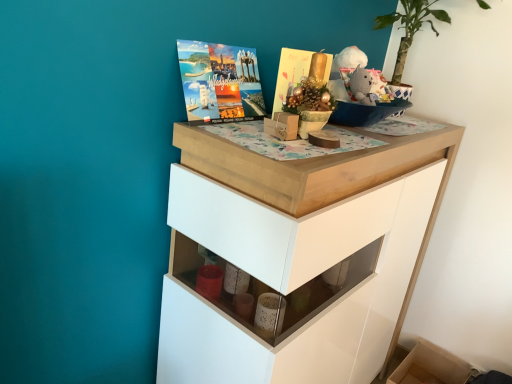
What do you see at coordinates (282, 126) in the screenshot? The image size is (512, 384). I see `matte brown box at center` at bounding box center [282, 126].

The image size is (512, 384). Identify the location of white glossy chest of drawers at upper center. (294, 257).

At what (x,y) coordinates should I click in order to perform the action: click on bare wood drawer at lower right. Please return your answer as a coordinate pair (x, y). The width and height of the screenshot is (512, 384). Looking at the image, I should click on (429, 367).

Image resolution: width=512 pixels, height=384 pixels. Find the location of `knitted gray bear at upper right`. knitted gray bear at upper right is located at coordinates (367, 86).

The height and width of the screenshot is (384, 512). I want to click on matte brown box at center, so click(282, 126).

Is matte brown box at center beside knitted gray bear at upper right?

They are not placed beside each other.

What's the angular difference between matte brown box at center and knitted gray bear at upper right's facing directions?

The facing directions of matte brown box at center and knitted gray bear at upper right are 11.1 degrees apart.

Can you confirm if matte brown box at center is bigger than knitted gray bear at upper right?

No, matte brown box at center is not bigger than knitted gray bear at upper right.

From a real-world perspective, is matte brown box at center above or below knitted gray bear at upper right?

From a real-world perspective, matte brown box at center is physically below knitted gray bear at upper right.

Is matte gold magazine at upper center beside white glossy chest of drawers at upper center?

There is a gap between matte gold magazine at upper center and white glossy chest of drawers at upper center.

Where is `magazine that is behind the white glossy chest of drawers at upper center`? magazine that is behind the white glossy chest of drawers at upper center is located at coordinates (290, 73).

Which object is positioned more to the left, matte gold magazine at upper center or white glossy chest of drawers at upper center?

From the viewer's perspective, matte gold magazine at upper center appears more on the left side.

Which is more distant, (290, 71) or (227, 162)?

The point (290, 71) is more distant.

Relative to matte gold magazine at upper center, is knitted gray bear at upper right in front or behind?

Clearly, knitted gray bear at upper right is behind matte gold magazine at upper center.

Is knitted gray bear at upper right spatially inside matte gold magazine at upper center, or outside of it?

knitted gray bear at upper right cannot be found inside matte gold magazine at upper center.

How much distance is there between knitted gray bear at upper right and matte gold magazine at upper center?

knitted gray bear at upper right is 10.01 inches away from matte gold magazine at upper center.

Does knitted gray bear at upper right have a greater width compared to matte gold magazine at upper center?

In fact, knitted gray bear at upper right might be narrower than matte gold magazine at upper center.

From a real-world perspective, who is located lower, bare wood drawer at lower right or matte brown box at center?

bare wood drawer at lower right, from a real-world perspective.

Is bare wood drawer at lower right with matte brown box at center?

bare wood drawer at lower right is not next to matte brown box at center, and they're not touching.

Measure the distance from bare wood drawer at lower right to matte brown box at center.

bare wood drawer at lower right and matte brown box at center are 4.93 feet apart from each other.

Is the depth of bare wood drawer at lower right less than that of knitted gray bear at upper right?

No, the depth of bare wood drawer at lower right is greater than that of knitted gray bear at upper right.

Which of these two, bare wood drawer at lower right or knitted gray bear at upper right, is smaller?

With smaller size is knitted gray bear at upper right.

From a real-world perspective, which is physically below, bare wood drawer at lower right or knitted gray bear at upper right?

bare wood drawer at lower right is physically lower.

Is bare wood drawer at lower right positioned with its back to matte gold magazine at upper center?

No, bare wood drawer at lower right is not facing away from matte gold magazine at upper center.

Considering the sizes of objects bare wood drawer at lower right and matte gold magazine at upper center in the image provided, who is smaller, bare wood drawer at lower right or matte gold magazine at upper center?

matte gold magazine at upper center is smaller.

Based on the photo, considering the sizes of objects bare wood drawer at lower right and matte gold magazine at upper center in the image provided, who is shorter, bare wood drawer at lower right or matte gold magazine at upper center?

Standing shorter between the two is matte gold magazine at upper center.

Is matte brown box at center to the left of bare wood drawer at lower right from the viewer's perspective?

Indeed, matte brown box at center is positioned on the left side of bare wood drawer at lower right.

Is matte brown box at center oriented away from bare wood drawer at lower right?

No, matte brown box at center is not facing the opposite direction of bare wood drawer at lower right.

How far apart are matte brown box at center and bare wood drawer at lower right?

matte brown box at center is 1.50 meters away from bare wood drawer at lower right.

Find the location of a particular element. box lying above the bare wood drawer at lower right (from the image's perspective) is located at coordinates (282, 126).

This screenshot has width=512, height=384. I want to click on animal above the matte brown box at center (from the image's perspective), so click(367, 86).

Find the location of `chest of drawers on the right of the matte gold magazine at upper center`. chest of drawers on the right of the matte gold magazine at upper center is located at coordinates (294, 257).

Considering their positions, is knitted gray bear at upper right positioned closer to matte brown box at center than matte gold magazine at upper center?

matte gold magazine at upper center is closer to matte brown box at center.

Estimate the real-world distances between objects in this image. Which object is closer to matte brown box at center, white glossy chest of drawers at upper center or knitted gray bear at upper right?

knitted gray bear at upper right lies closer to matte brown box at center than the other object.

Based on the photo, estimate the real-world distances between objects in this image. Which object is closer to matte gold magazine at upper center, matte brown box at center or knitted gray bear at upper right?

Among the two, matte brown box at center is located nearer to matte gold magazine at upper center.

Estimate the real-world distances between objects in this image. Which object is closer to matte gold magazine at upper center, white glossy chest of drawers at upper center or bare wood drawer at lower right?

white glossy chest of drawers at upper center is positioned closer to the anchor matte gold magazine at upper center.

Estimate the real-world distances between objects in this image. Which object is closer to matte gold magazine at upper center, bare wood drawer at lower right or matte brown box at center?

The object closer to matte gold magazine at upper center is matte brown box at center.

When comparing their distances from bare wood drawer at lower right, does matte brown box at center or white glossy chest of drawers at upper center seem closer?

Among the two, white glossy chest of drawers at upper center is located nearer to bare wood drawer at lower right.

In the scene shown: From the image, which object appears to be farther from matte brown box at center, knitted gray bear at upper right or white glossy chest of drawers at upper center?

Among the two, white glossy chest of drawers at upper center is located further to matte brown box at center.

Considering their positions, is bare wood drawer at lower right positioned closer to matte gold magazine at upper center than white glossy chest of drawers at upper center?

white glossy chest of drawers at upper center is closer to matte gold magazine at upper center.

Identify the location of box between knitted gray bear at upper right and white glossy chest of drawers at upper center in the vertical direction. (282, 126).

The height and width of the screenshot is (384, 512). I want to click on box between matte gold magazine at upper center and white glossy chest of drawers at upper center from top to bottom, so click(x=282, y=126).

Find the location of `box between knitted gray bear at upper right and bare wood drawer at lower right from top to bottom`. box between knitted gray bear at upper right and bare wood drawer at lower right from top to bottom is located at coordinates (282, 126).

The height and width of the screenshot is (384, 512). Identify the location of the chest of drawers that lies between matte gold magazine at upper center and bare wood drawer at lower right from top to bottom. 294,257.